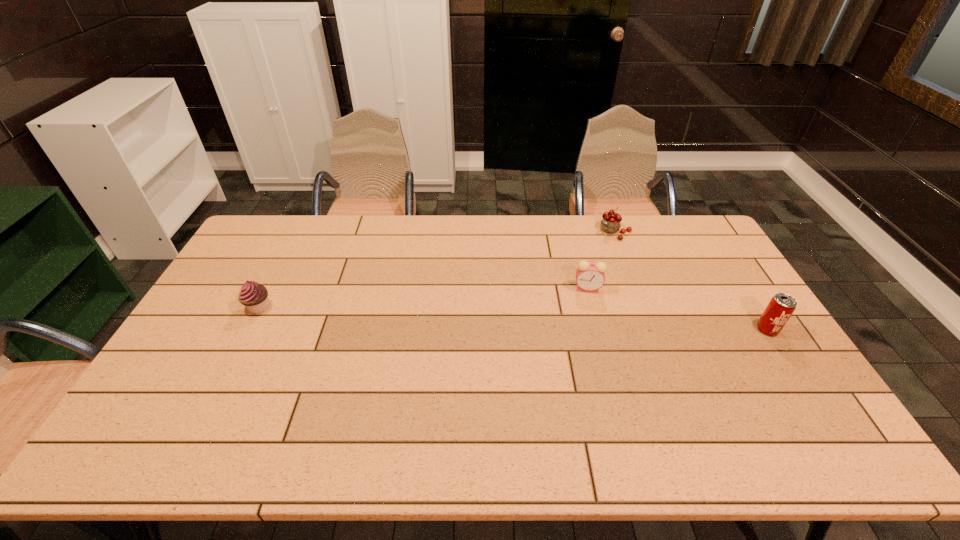
In order to click on vacant position at the near edge of the desktop in this screenshot , I will do `click(263, 397)`.

You are a GUI agent. You are given a task and a screenshot of the screen. Output one action in this format:
    pyautogui.click(x=<x>, y=<y>)
    Task: Click on the blank space at the left edge
    This screenshot has width=960, height=540.
    Given the screenshot: What is the action you would take?
    pyautogui.click(x=214, y=362)

Identify the location of free spot at the right edge of the desktop. This screenshot has height=540, width=960. (763, 368).

Identify the location of free space at the far right corner of the desktop. The image size is (960, 540). (679, 247).

Where is `free region at the near right corner`? free region at the near right corner is located at coordinates (749, 395).

This screenshot has width=960, height=540. Find the location of `free space between the cupcake and the alarm clock`. free space between the cupcake and the alarm clock is located at coordinates (423, 298).

Where is `vacant space in between the third farthest object and the second farthest object`? vacant space in between the third farthest object and the second farthest object is located at coordinates (423, 298).

Locate an element on the screen. vacant space that's between the beer can and the third object from left to right is located at coordinates (690, 281).

Locate an element on the screen. This screenshot has width=960, height=540. vacant region between the beer can and the cupcake is located at coordinates (513, 318).

This screenshot has width=960, height=540. Find the location of `free area in between the beer can and the farthest object`. free area in between the beer can and the farthest object is located at coordinates (690, 281).